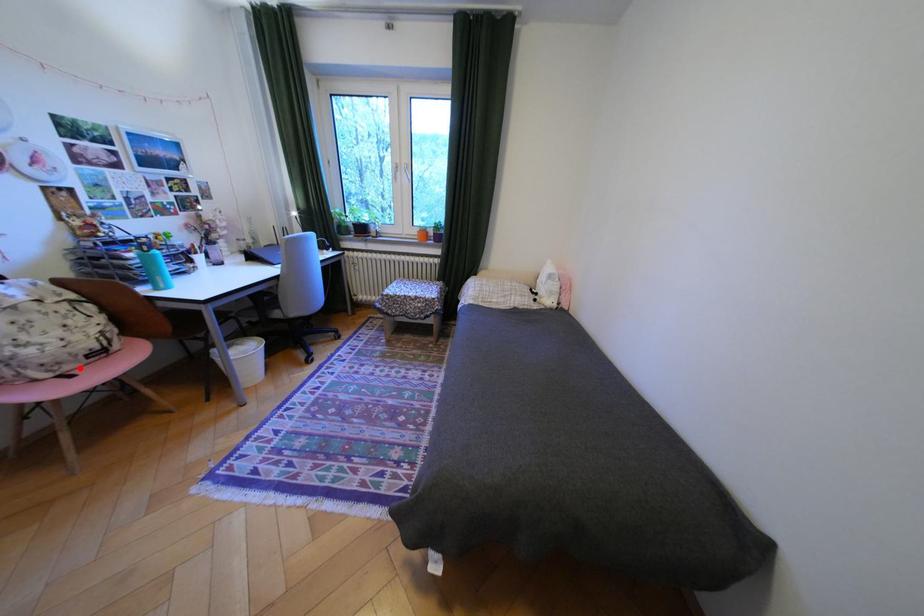
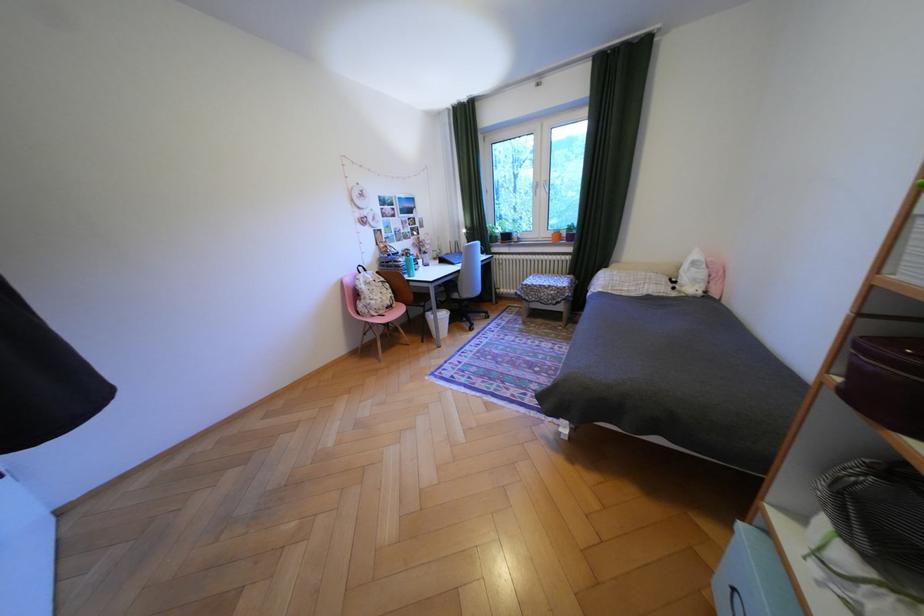
The point at the highlighted location is marked in the first image. Where is the corresponding point in the second image?

(393, 312)